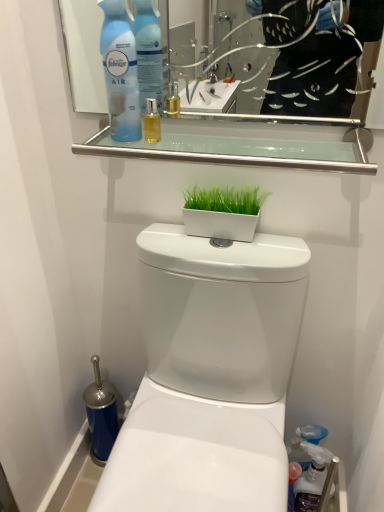
Locate an element on the screen. vacant space to the right of blue plastic air freshener at upper left, which appears as the 1th cleaning product when viewed from the top is located at coordinates (214, 142).